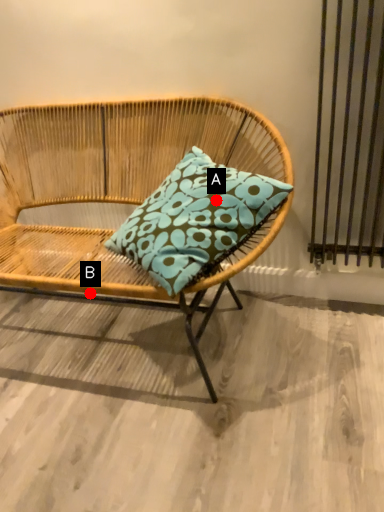
Question: Two points are circled on the image, labeled by A and B beside each circle. Which point is closer to the camera?

Choices:
 (A) A is closer
 (B) B is closer

Answer: (A)